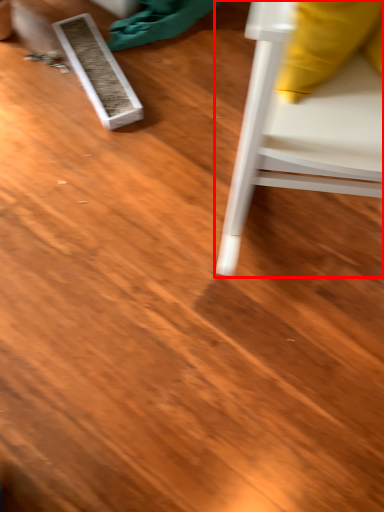
Question: From the image's perspective, what is the correct spatial positioning of furniture (annotated by the red box) in reference to plank?

Choices:
 (A) below
 (B) above

Answer: (A)